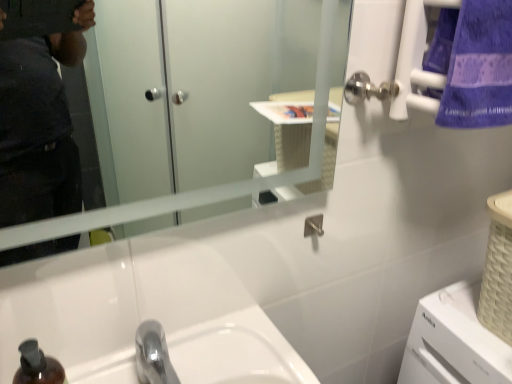
Image resolution: width=512 pixels, height=384 pixels. Describe the element at coordinates (473, 64) in the screenshot. I see `purple cotton towel at upper right` at that location.

Locate an element on the screen. This screenshot has width=512, height=384. chrome metallic sink at center is located at coordinates (236, 351).

Find the location of `clear glass mirror at upper center`. clear glass mirror at upper center is located at coordinates (192, 190).

Find the location of a particular element. The width and height of the screenshot is (512, 384). purple cotton towel at upper right is located at coordinates (473, 64).

From a real-world perspective, is chrome metallic sink at center located higher than clear glass mirror at upper center?

Incorrect, from a real-world perspective, chrome metallic sink at center is lower than clear glass mirror at upper center.

Would you say chrome metallic sink at center is a long distance from clear glass mirror at upper center?

chrome metallic sink at center is actually quite close to clear glass mirror at upper center.

I want to click on sink on the left side of clear glass mirror at upper center, so click(236, 351).

Where is `mirror that appears above the chrome metallic sink at center (from the image's perspective)`? This screenshot has width=512, height=384. mirror that appears above the chrome metallic sink at center (from the image's perspective) is located at coordinates (192, 190).

Considering the relative sizes of clear glass mirror at upper center and chrome metallic sink at center in the image provided, is clear glass mirror at upper center shorter than chrome metallic sink at center?

No, clear glass mirror at upper center is not shorter than chrome metallic sink at center.

From a real-world perspective, who is located higher, clear glass mirror at upper center or chrome metallic sink at center?

clear glass mirror at upper center, from a real-world perspective.

Based on the photo, in terms of width, does clear glass mirror at upper center look wider or thinner when compared to chrome metallic sink at center?

Clearly, clear glass mirror at upper center has less width compared to chrome metallic sink at center.

From a real-world perspective, relative to purple cotton towel at upper right, is chrome metallic sink at center vertically above or below?

Clearly, from a real-world perspective, chrome metallic sink at center is below purple cotton towel at upper right.

Is chrome metallic sink at center not inside purple cotton towel at upper right?

chrome metallic sink at center is positioned outside purple cotton towel at upper right.

I want to click on towel/napkin lying on the right of chrome metallic sink at center, so click(x=473, y=64).

From the picture: Are chrome metallic sink at center and purple cotton towel at upper right far apart?

chrome metallic sink at center is actually quite close to purple cotton towel at upper right.

From the image's perspective, does purple cotton towel at upper right appear higher than chrome metallic sink at center?

Yes, from the image's perspective, purple cotton towel at upper right is over chrome metallic sink at center.

Considering the relative positions of purple cotton towel at upper right and chrome metallic sink at center in the image provided, is purple cotton towel at upper right to the right of chrome metallic sink at center from the viewer's perspective?

Correct, you'll find purple cotton towel at upper right to the right of chrome metallic sink at center.

Is purple cotton towel at upper right situated inside chrome metallic sink at center or outside?

purple cotton towel at upper right lies outside chrome metallic sink at center.

How many degrees apart are the facing directions of purple cotton towel at upper right and chrome metallic sink at center?

There is a 0.592-degree angle between the facing directions of purple cotton towel at upper right and chrome metallic sink at center.

Is purple cotton towel at upper right aimed at clear glass mirror at upper center?

No, purple cotton towel at upper right is not facing towards clear glass mirror at upper center.

Can you confirm if purple cotton towel at upper right is shorter than clear glass mirror at upper center?

Yes, purple cotton towel at upper right is shorter than clear glass mirror at upper center.

From a real-world perspective, is purple cotton towel at upper right under clear glass mirror at upper center?

No.

How different are the orientations of clear glass mirror at upper center and purple cotton towel at upper right in degrees?

The angle between the facing direction of clear glass mirror at upper center and the facing direction of purple cotton towel at upper right is 0.000226 degrees.

Is clear glass mirror at upper center taller or shorter than purple cotton towel at upper right?

Considering their sizes, clear glass mirror at upper center has more height than purple cotton towel at upper right.

Is clear glass mirror at upper center looking in the opposite direction of purple cotton towel at upper right?

No, clear glass mirror at upper center's orientation is not away from purple cotton towel at upper right.

Is clear glass mirror at upper center bigger than purple cotton towel at upper right?

Indeed, clear glass mirror at upper center has a larger size compared to purple cotton towel at upper right.

Locate an element on the screen. This screenshot has height=384, width=512. sink behind the clear glass mirror at upper center is located at coordinates (236, 351).

At what (x,y) coordinates should I click in order to perform the action: click on sink located below the clear glass mirror at upper center (from the image's perspective). Please return your answer as a coordinate pair (x, y). Looking at the image, I should click on (236, 351).

Estimate the real-world distances between objects in this image. Which object is closer to purple cotton towel at upper right, chrome metallic sink at center or clear glass mirror at upper center?

clear glass mirror at upper center is positioned closer to the anchor purple cotton towel at upper right.

Which object lies further to the anchor point chrome metallic sink at center, clear glass mirror at upper center or purple cotton towel at upper right?

purple cotton towel at upper right is further to chrome metallic sink at center.

From the image, which object appears to be nearer to clear glass mirror at upper center, chrome metallic sink at center or purple cotton towel at upper right?

purple cotton towel at upper right is closer to clear glass mirror at upper center.

Based on the photo, looking at the image, which one is located further to purple cotton towel at upper right, clear glass mirror at upper center or chrome metallic sink at center?

chrome metallic sink at center is further to purple cotton towel at upper right.

Which object lies nearer to the anchor point clear glass mirror at upper center, purple cotton towel at upper right or chrome metallic sink at center?

The object closer to clear glass mirror at upper center is purple cotton towel at upper right.

Looking at this image, which object lies nearer to the anchor point chrome metallic sink at center, purple cotton towel at upper right or clear glass mirror at upper center?

The object closer to chrome metallic sink at center is clear glass mirror at upper center.

Locate an element on the screen. The height and width of the screenshot is (384, 512). mirror that lies between purple cotton towel at upper right and chrome metallic sink at center from top to bottom is located at coordinates (192, 190).